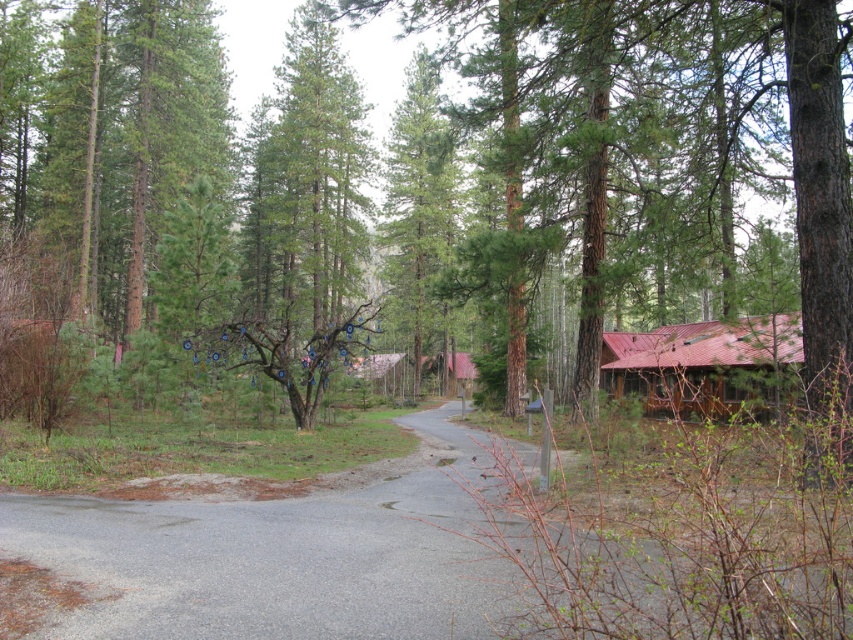
Is point (561, 164) positioned in front of point (785, 369)?

No, (561, 164) is further to viewer.

Between green matte tree at center and metallic red cabin at right, which one appears on the left side from the viewer's perspective?

From the viewer's perspective, green matte tree at center appears more on the left side.

Where is `green matte tree at center`? green matte tree at center is located at coordinates (418, 177).